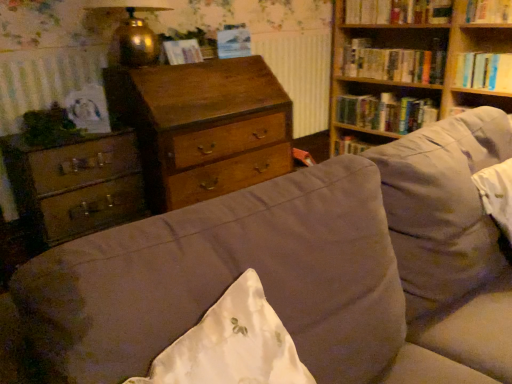
Identify the location of free spot in front of matte paper at center, acting as the second paperback book starting from the right. This screenshot has width=512, height=384. [x=163, y=66].